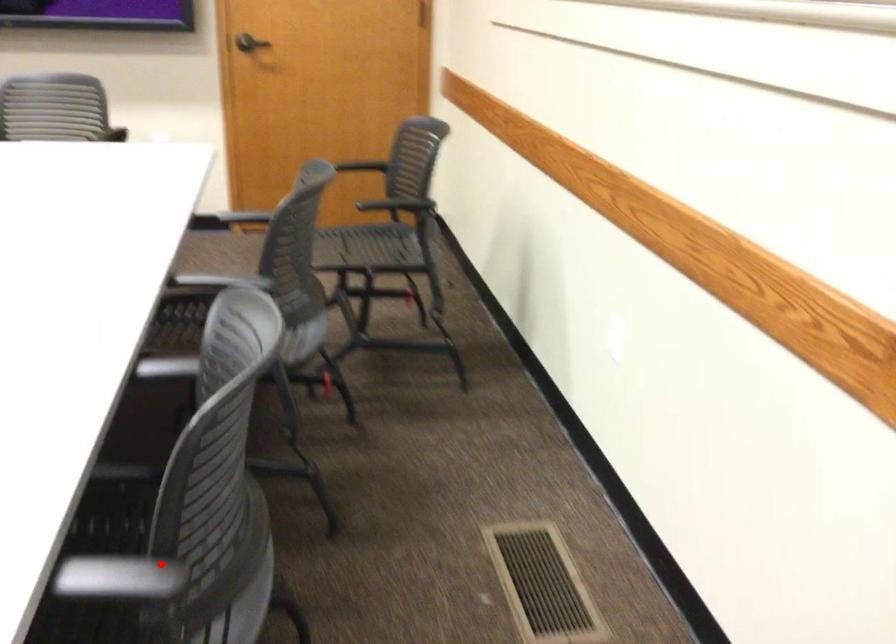
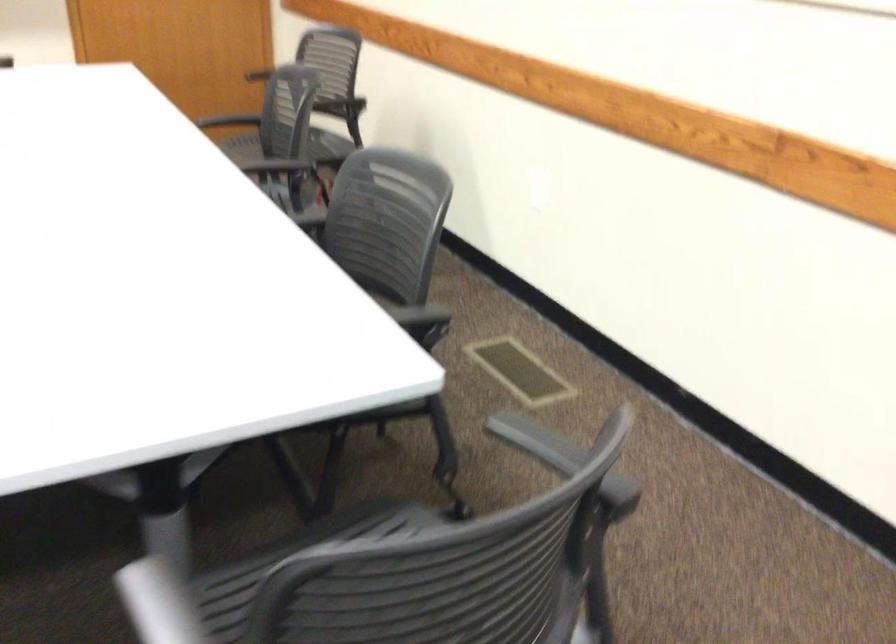
Question: I am providing you with two images of the same scene from different viewpoints. A red point is shown in image1. For the corresponding object point in image2, is it positioned nearer or farther from the camera?

Choices:
 (A) Nearer
 (B) Farther

Answer: (B)